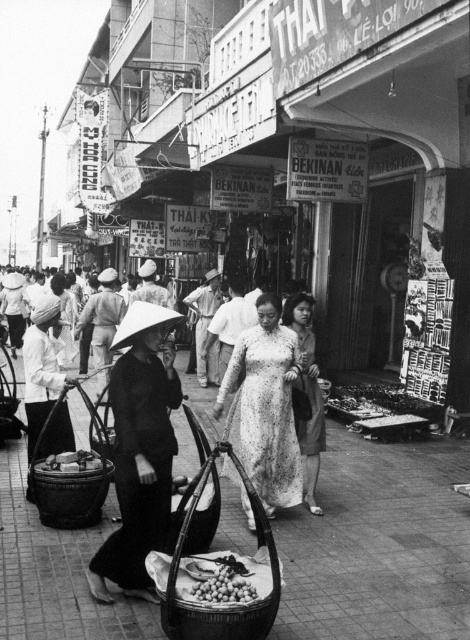
Does black matte conical hat at center lie behind white lace dress at center?

No, it is in front of white lace dress at center.

Can you confirm if black matte conical hat at center is wider than white lace dress at center?

Yes.

What do you see at coordinates (140, 449) in the screenshot? I see `black matte conical hat at center` at bounding box center [140, 449].

This screenshot has width=470, height=640. Identify the location of black matte conical hat at center. (140, 449).

Consider the image. Which is above, smooth brown nuts at center or smooth brown fruit at lower left?

smooth brown fruit at lower left is higher up.

Who is positioned more to the right, smooth brown nuts at center or smooth brown fruit at lower left?

smooth brown nuts at center

Is point (247, 580) behind point (76, 456)?

No, (247, 580) is in front of (76, 456).

This screenshot has width=470, height=640. Find the location of `smooth brown nuts at center`. smooth brown nuts at center is located at coordinates (221, 580).

Does white floral dress at center have a lesser width compared to smooth brown nuts at center?

In fact, white floral dress at center might be wider than smooth brown nuts at center.

Does point (280, 484) lie behind point (201, 576)?

Yes, point (280, 484) is behind point (201, 576).

I want to click on white floral dress at center, so click(x=265, y=406).